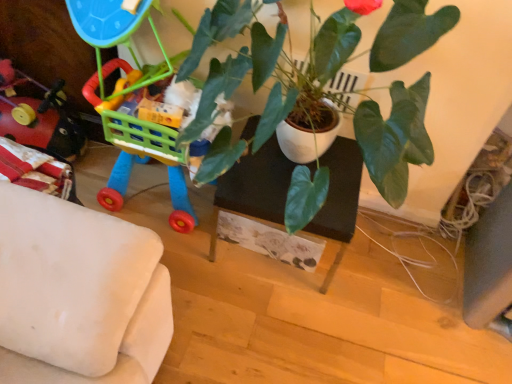
Question: Does black matte table at center appear on the left side of green glossy plant at center?

Choices:
 (A) yes
 (B) no

Answer: (A)

Question: Is black matte table at center to the right of green glossy plant at center from the viewer's perspective?

Choices:
 (A) no
 (B) yes

Answer: (A)

Question: Is black matte table at center far from green glossy plant at center?

Choices:
 (A) no
 (B) yes

Answer: (A)

Question: From the image's perspective, is black matte table at center located beneath green glossy plant at center?

Choices:
 (A) yes
 (B) no

Answer: (A)

Question: Does black matte table at center lie in front of green glossy plant at center?

Choices:
 (A) no
 (B) yes

Answer: (A)

Question: Looking at their shapes, would you say plastic toy cart at left, the 1th toy from the right, is wider or thinner than rubberized plastic toy at left, the second toy viewed from the right?

Choices:
 (A) thin
 (B) wide

Answer: (B)

Question: Based on their positions, is plastic toy cart at left, which is the second toy in left-to-right order, located to the left or right of rubberized plastic toy at left, which appears as the first toy when viewed from the left?

Choices:
 (A) left
 (B) right

Answer: (B)

Question: From the image's perspective, is plastic toy cart at left, the 1th toy from the right, located above or below rubberized plastic toy at left, which appears as the first toy when viewed from the left?

Choices:
 (A) above
 (B) below

Answer: (A)

Question: Is plastic toy cart at left, the 1th toy from the right, inside or outside of rubberized plastic toy at left, which appears as the first toy when viewed from the left?

Choices:
 (A) outside
 (B) inside

Answer: (A)

Question: Is black matte table at center inside the boundaries of green glossy plant at center, or outside?

Choices:
 (A) outside
 (B) inside

Answer: (A)

Question: Would you say black matte table at center is to the left or to the right of green glossy plant at center in the picture?

Choices:
 (A) left
 (B) right

Answer: (A)

Question: Is black matte table at center wider or thinner than green glossy plant at center?

Choices:
 (A) wide
 (B) thin

Answer: (B)

Question: Is black matte table at center taller or shorter than green glossy plant at center?

Choices:
 (A) tall
 (B) short

Answer: (B)

Question: From the image's perspective, relative to black matte table at center, is rubberized plastic toy at left, the second toy viewed from the right, above or below?

Choices:
 (A) below
 (B) above

Answer: (B)

Question: Considering the positions of rubberized plastic toy at left, the second toy viewed from the right, and black matte table at center in the image, is rubberized plastic toy at left, the second toy viewed from the right, taller or shorter than black matte table at center?

Choices:
 (A) tall
 (B) short

Answer: (B)